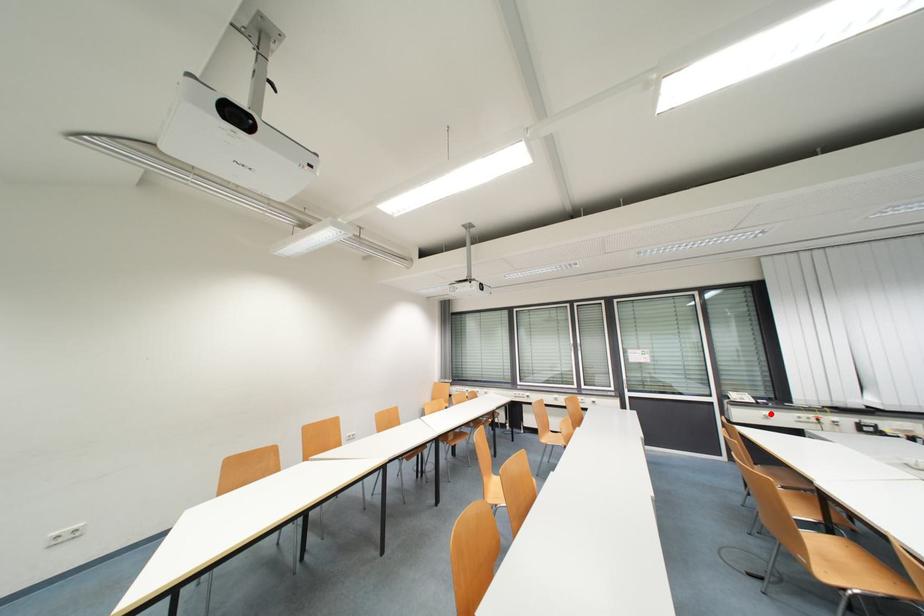
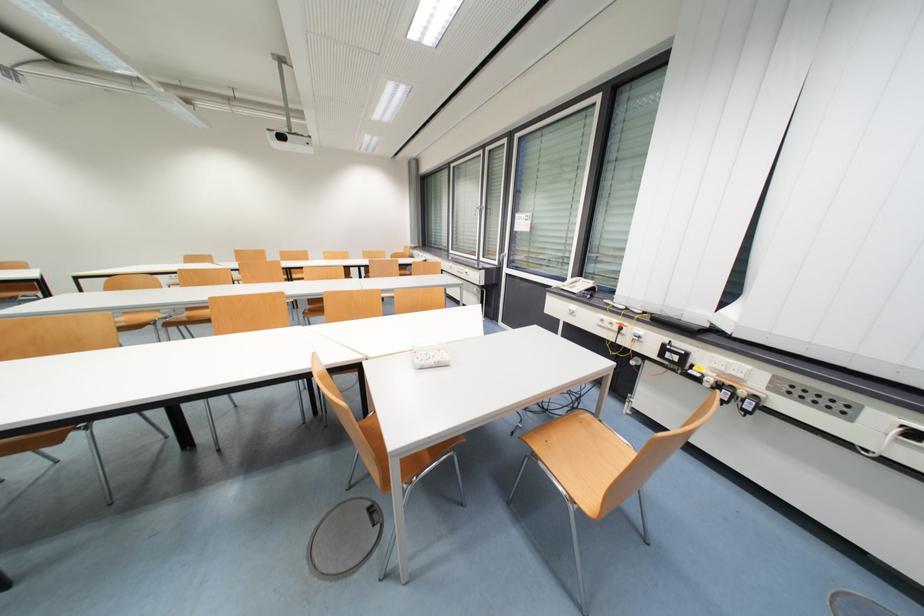
The point at the highlighted location is marked in the first image. Where is the corresponding point in the second image?

(578, 309)